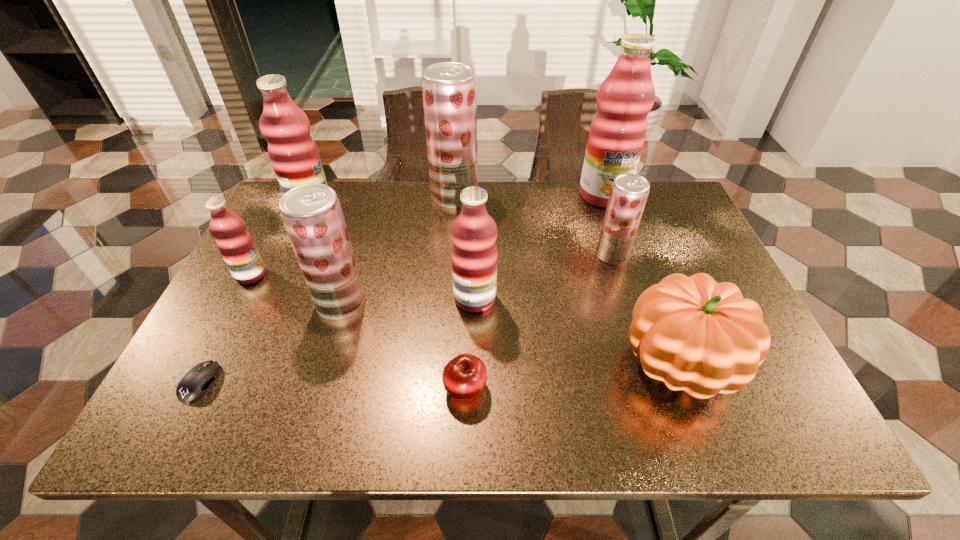
The image size is (960, 540). What are the coordinates of `vacant point located between the second farthest strawberry fruit juice and the shortest object` in the screenshot? It's located at (406, 319).

Locate an element on the screen. The width and height of the screenshot is (960, 540). unoccupied position between the third fruit juice from left to right and the orange pumpkin is located at coordinates (510, 334).

Where is `the ninth closest object to the smallest strawberry fruit juice`? the ninth closest object to the smallest strawberry fruit juice is located at coordinates (195, 382).

Identify which object is the fifth closest to the apple. Please provide its 2D coordinates. Your answer should be formatted as a tuple, i.e. [(x, y)], where the tuple contains the x and y coordinates of a point satisfying the conditions above.

[(195, 382)]

This screenshot has height=540, width=960. Identify the location of the fifth closest fruit juice relative to the tallest object. (294, 155).

The image size is (960, 540). In order to click on the fourth closest fruit juice relative to the second shortest object in this screenshot , I will do [235, 244].

Locate which pink fruit juice is the third closest to the biggest pink fruit juice. Please provide its 2D coordinates. Your answer should be formatted as a tuple, i.e. [(x, y)], where the tuple contains the x and y coordinates of a point satisfying the conditions above.

[(235, 244)]

Select which pink fruit juice appears as the third closest to the second biggest pink fruit juice. Please provide its 2D coordinates. Your answer should be formatted as a tuple, i.e. [(x, y)], where the tuple contains the x and y coordinates of a point satisfying the conditions above.

[(618, 129)]

Find the location of a particular element. strawberry fruit juice identified as the closest to the orange pumpkin is located at coordinates (629, 192).

Choose which strawberry fruit juice is the second nearest neighbor to the smallest pink fruit juice. Please provide its 2D coordinates. Your answer should be formatted as a tuple, i.e. [(x, y)], where the tuple contains the x and y coordinates of a point satisfying the conditions above.

[(449, 89)]